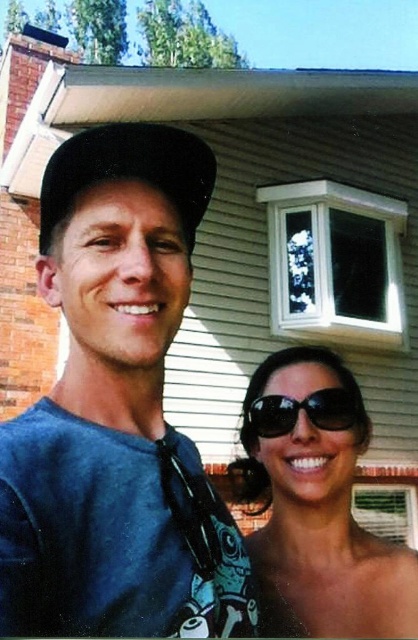
You are a photographer taking a picture of the two points in the scene. Which point, point (x=402, y=605) or point (x=152, y=148), is closer to the camera?

Point (x=152, y=148) is closer to the camera because the description states that point (x=402, y=605) is further away from the camera than point (x=152, y=148).